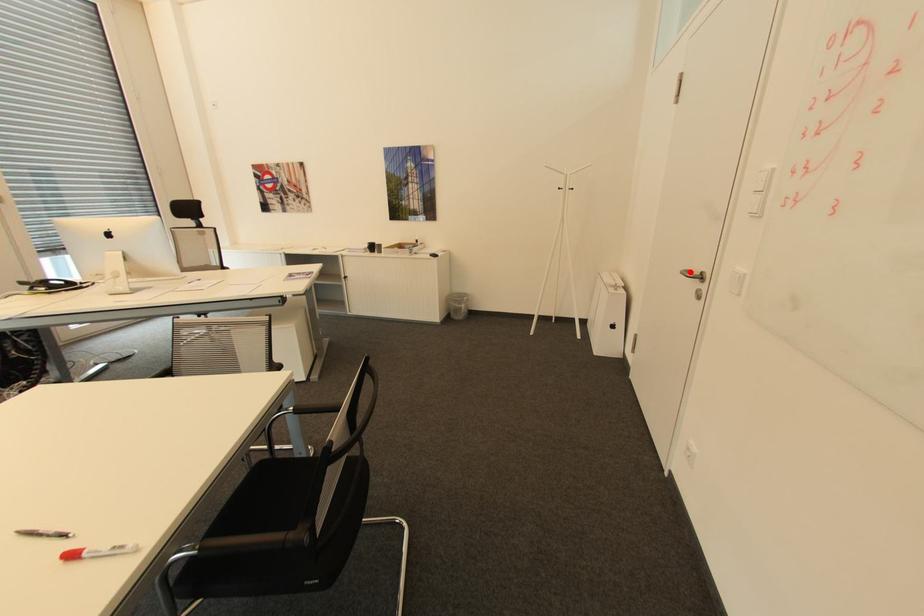
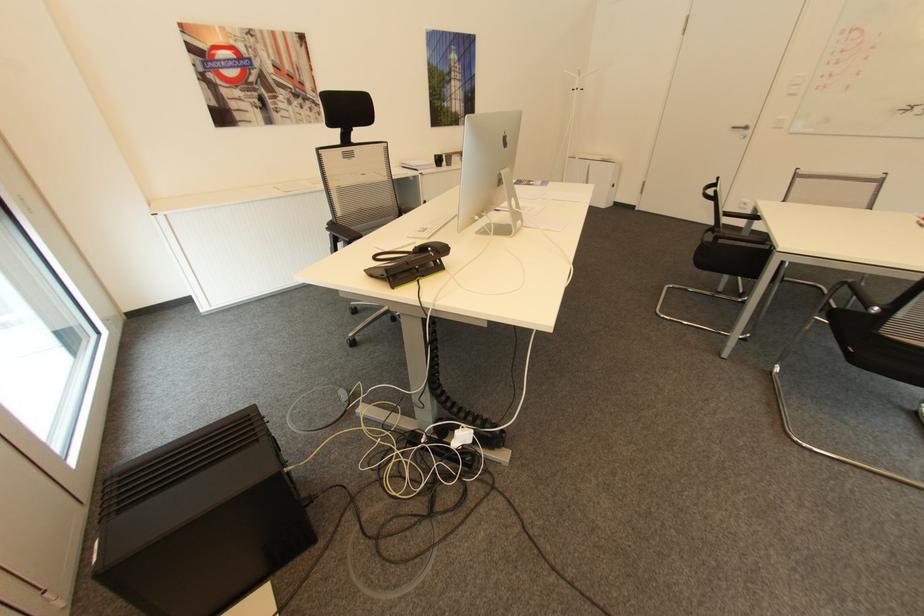
Where in the second image is the point corresponding to the highlighted location from the first image?

(736, 128)